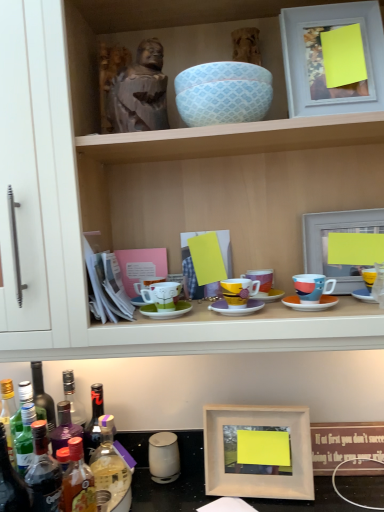
Question: Is translucent plastic bottle at lower left, which is the 2th bottle from right to left, thinner than translucent plastic bottle at lower left, the first bottle viewed from the right?

Choices:
 (A) no
 (B) yes

Answer: (B)

Question: Can you confirm if translucent plastic bottle at lower left, which is the 2th bottle from right to left, is positioned to the left of translucent plastic bottle at lower left, the 4th bottle when ordered from left to right?

Choices:
 (A) no
 (B) yes

Answer: (B)

Question: Considering the relative sizes of translucent plastic bottle at lower left, the 3th bottle when ordered from left to right, and translucent plastic bottle at lower left, the 4th bottle when ordered from left to right, in the image provided, is translucent plastic bottle at lower left, the 3th bottle when ordered from left to right, taller than translucent plastic bottle at lower left, the 4th bottle when ordered from left to right,?

Choices:
 (A) yes
 (B) no

Answer: (A)

Question: From the image's perspective, is translucent plastic bottle at lower left, which is the 2th bottle from right to left, located beneath translucent plastic bottle at lower left, the first bottle viewed from the right?

Choices:
 (A) yes
 (B) no

Answer: (A)

Question: Can you confirm if translucent plastic bottle at lower left, the 3th bottle when ordered from left to right, is positioned to the right of translucent plastic bottle at lower left, the first bottle viewed from the right?

Choices:
 (A) yes
 (B) no

Answer: (B)

Question: In terms of height, does matte white picture frame at upper right, the first picture frame in the top-to-bottom sequence, look taller or shorter compared to wooden picture frame at right, the 3th picture frame in the bottom-to-top sequence?

Choices:
 (A) short
 (B) tall

Answer: (B)

Question: Based on their sizes in the image, would you say matte white picture frame at upper right, the first picture frame in the top-to-bottom sequence, is bigger or smaller than wooden picture frame at right, which ranks as the second picture frame in top-to-bottom order?

Choices:
 (A) small
 (B) big

Answer: (B)

Question: From the image's perspective, relative to wooden picture frame at right, the 3th picture frame in the bottom-to-top sequence, is matte white picture frame at upper right, the fourth picture frame when ordered from bottom to top, above or below?

Choices:
 (A) below
 (B) above

Answer: (B)

Question: Choose the correct answer: Is matte white picture frame at upper right, the first picture frame in the top-to-bottom sequence, inside wooden picture frame at right, which ranks as the second picture frame in top-to-bottom order, or outside it?

Choices:
 (A) outside
 (B) inside

Answer: (A)

Question: Would you say blue patterned bowl at upper center, the first bowl viewed from the top, is inside or outside translucent plastic bottle at lower left, the 3th bottle positioned from the right?

Choices:
 (A) outside
 (B) inside

Answer: (A)

Question: Based on their positions, is blue patterned bowl at upper center, the 2th bowl ordered from the bottom, located to the left or right of translucent plastic bottle at lower left, placed as the second bottle when sorted from left to right?

Choices:
 (A) left
 (B) right

Answer: (B)

Question: Looking at the image, does blue patterned bowl at upper center, the first bowl viewed from the top, seem bigger or smaller compared to translucent plastic bottle at lower left, the 3th bottle positioned from the right?

Choices:
 (A) small
 (B) big

Answer: (A)

Question: From a real-world perspective, is blue patterned bowl at upper center, the first bowl viewed from the top, physically located above or below translucent plastic bottle at lower left, the 3th bottle positioned from the right?

Choices:
 (A) below
 (B) above

Answer: (B)

Question: Is matte ceramic mug at right, which ranks as the 4th coffee cup in left-to-right order, inside or outside of wooden statue at upper center?

Choices:
 (A) inside
 (B) outside

Answer: (A)

Question: In terms of width, does matte ceramic mug at right, which is the 1th coffee cup in right-to-left order, look wider or thinner when compared to wooden statue at upper center?

Choices:
 (A) wide
 (B) thin

Answer: (B)